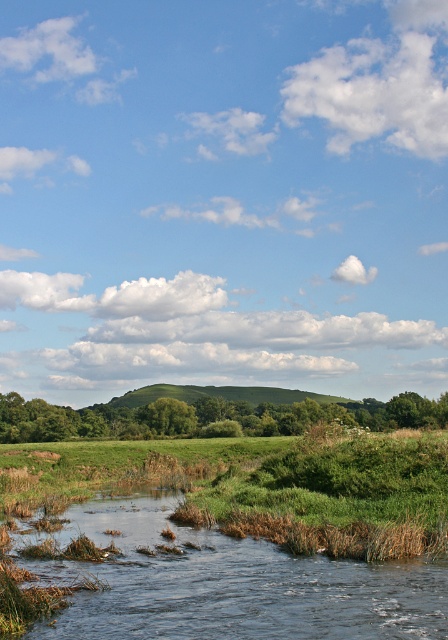
Is clear water at lower left shorter than green leafy hill at center?

Indeed, clear water at lower left has a lesser height compared to green leafy hill at center.

Which is more to the left, clear water at lower left or green leafy hill at center?

From the viewer's perspective, green leafy hill at center appears more on the left side.

Image resolution: width=448 pixels, height=640 pixels. What do you see at coordinates (224, 582) in the screenshot? I see `clear water at lower left` at bounding box center [224, 582].

Find the location of `clear water at lower left`. clear water at lower left is located at coordinates (224, 582).